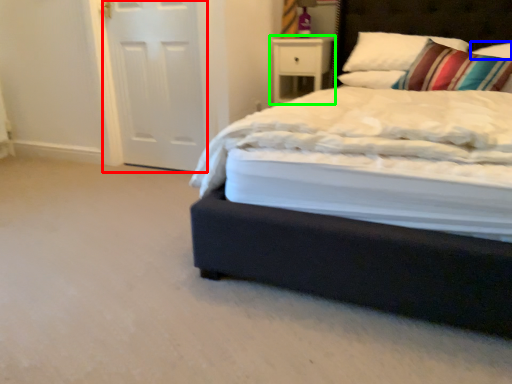
Question: Which object is the closest to the screen door (highlighted by a red box)? Choose among these: pillow (highlighted by a blue box) or nightstand (highlighted by a green box).

Choices:
 (A) pillow
 (B) nightstand

Answer: (B)